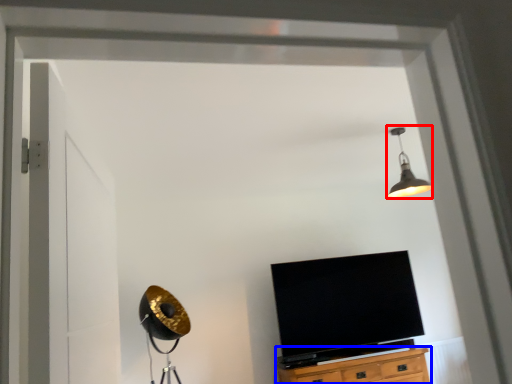
Question: Which object is further to the camera taking this photo, light fixture (highlighted by a red box) or cabinetry (highlighted by a blue box)?

Choices:
 (A) light fixture
 (B) cabinetry

Answer: (B)